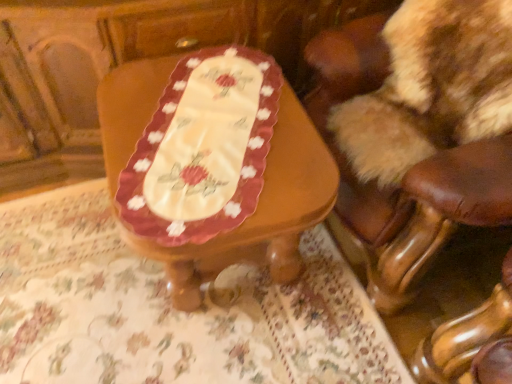
What are the coordinates of `free location to the left of wooden table at center` in the screenshot? It's located at (72, 275).